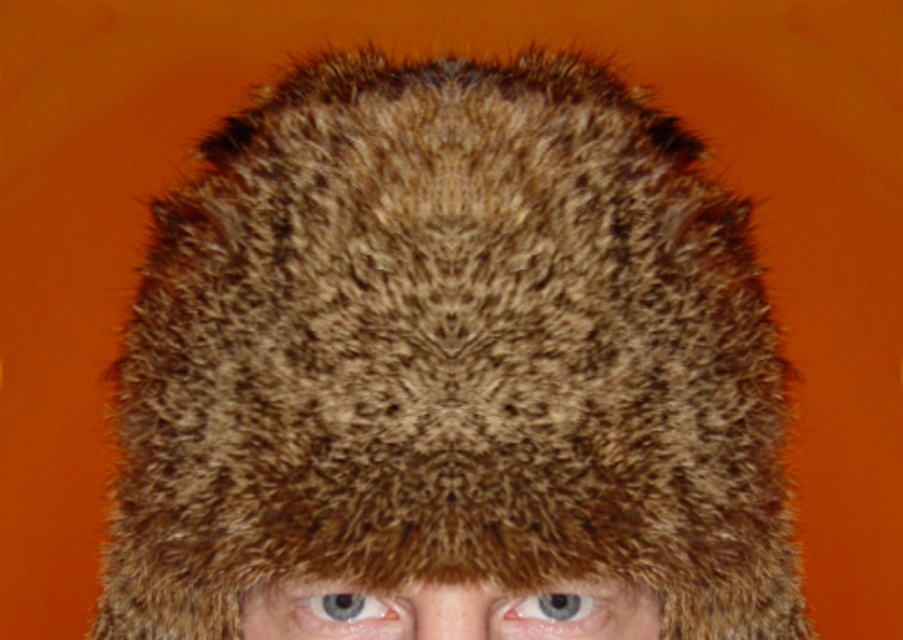
You are an optometrist examining a patient. You notice two eyes in the image, the blue glossy eye at center and the blue iridescent eye at center. Which eye has a greater width?

The blue glossy eye at center has a greater width than the blue iridescent eye at center according to the description.